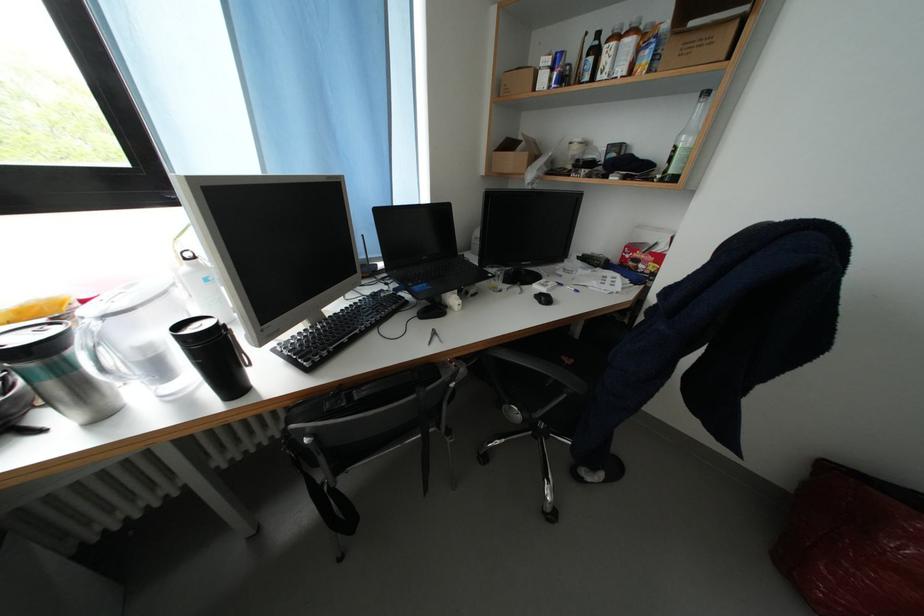
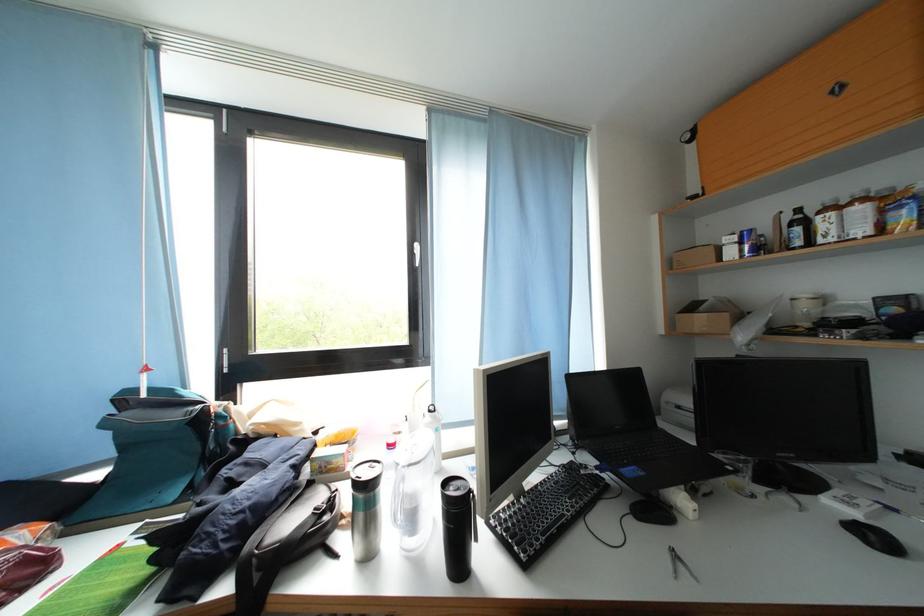
In the second image, find the point that corresponds to (x=58, y=390) in the first image.

(369, 521)